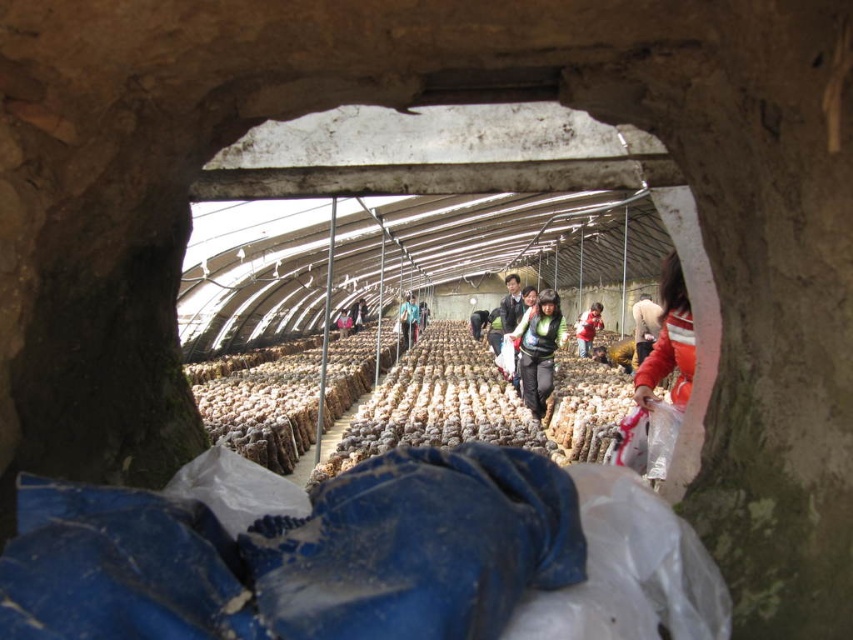
Question: Which is farther from the dark blue jeans at center?

Choices:
 (A) red fabric jacket at center
 (B) blue fabric bag at center

Answer: (A)

Question: Is dark blue jeans at center below light brown fabric jacket at center?

Choices:
 (A) yes
 (B) no

Answer: (B)

Question: Is dark green fabric at center above dark blue fabric at center?

Choices:
 (A) no
 (B) yes

Answer: (A)

Question: Does fluffy white dog at right lie in front of red fabric jacket at center?

Choices:
 (A) no
 (B) yes

Answer: (B)

Question: Which of the following is the closest to the observer?

Choices:
 (A) orange fabric bag at right
 (B) blue fabric bag at center

Answer: (A)

Question: Which of the following is the closest to the observer?

Choices:
 (A) red fabric jacket at center
 (B) blue fabric bag at center
 (C) dark blue jeans at center

Answer: (A)